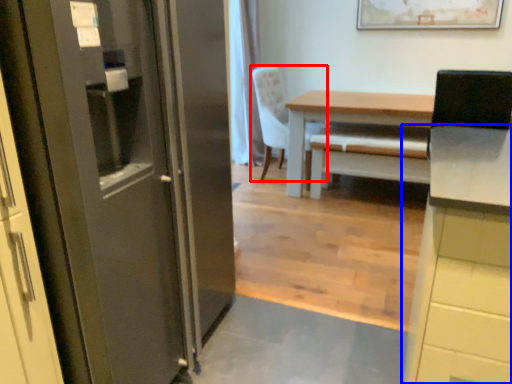
Question: Which object appears farthest to the camera in this image, chair (highlighted by a red box) or cabinetry (highlighted by a blue box)?

Choices:
 (A) chair
 (B) cabinetry

Answer: (A)